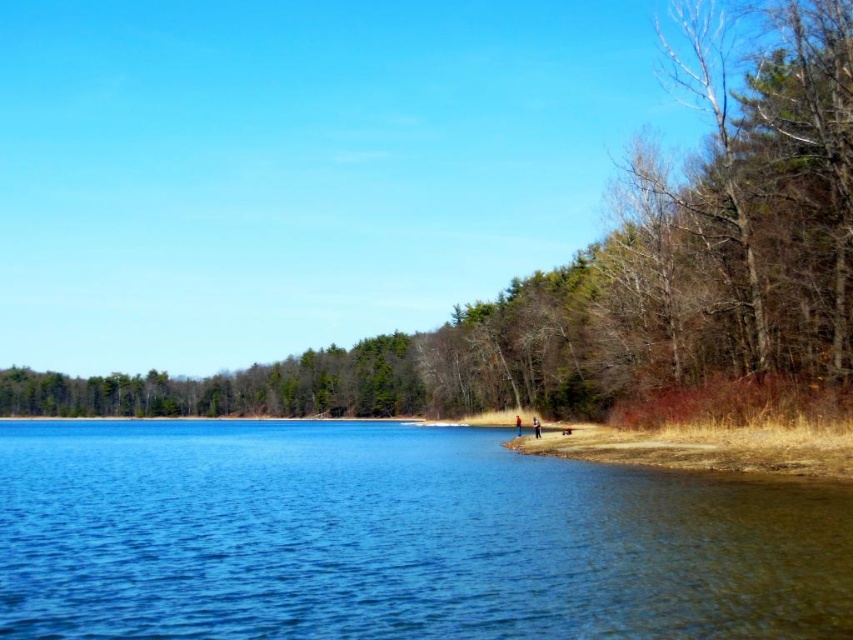
Does blue water at lower left appear over brown/dry wood at right?

→ Incorrect, blue water at lower left is not positioned above brown/dry wood at right.

Locate an element on the screen. This screenshot has height=640, width=853. blue water at lower left is located at coordinates (396, 538).